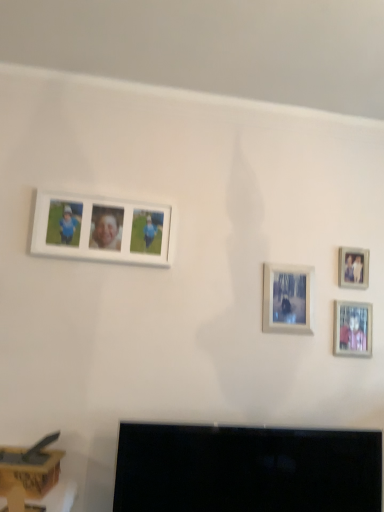
Question: Can you confirm if black glossy tv at lower center is shorter than white matte photo frame at upper left, placed as the 4th picture frame when sorted from right to left?

Choices:
 (A) no
 (B) yes

Answer: (A)

Question: Does black glossy tv at lower center lie behind white matte photo frame at upper left, which ranks as the 1th picture frame in left-to-right order?

Choices:
 (A) no
 (B) yes

Answer: (A)

Question: Does black glossy tv at lower center have a greater width compared to white matte photo frame at upper left, which ranks as the 1th picture frame in left-to-right order?

Choices:
 (A) no
 (B) yes

Answer: (B)

Question: Is black glossy tv at lower center to the left of white matte photo frame at upper left, placed as the 4th picture frame when sorted from right to left, from the viewer's perspective?

Choices:
 (A) no
 (B) yes

Answer: (A)

Question: From the image's perspective, is black glossy tv at lower center under white matte photo frame at upper left, placed as the 4th picture frame when sorted from right to left?

Choices:
 (A) yes
 (B) no

Answer: (A)

Question: Does black glossy tv at lower center have a greater height compared to white matte photo frame at upper left, placed as the 4th picture frame when sorted from right to left?

Choices:
 (A) no
 (B) yes

Answer: (B)

Question: Is white matte photo frame at upper left, placed as the 4th picture frame when sorted from right to left, surrounding wooden photo frame at upper right, the first picture frame when ordered from right to left?

Choices:
 (A) no
 (B) yes

Answer: (A)

Question: Considering the relative sizes of white matte photo frame at upper left, placed as the 4th picture frame when sorted from right to left, and wooden photo frame at upper right, which appears as the 4th picture frame when viewed from the left, in the image provided, is white matte photo frame at upper left, placed as the 4th picture frame when sorted from right to left, thinner than wooden photo frame at upper right, which appears as the 4th picture frame when viewed from the left,?

Choices:
 (A) yes
 (B) no

Answer: (B)

Question: Does white matte photo frame at upper left, which ranks as the 1th picture frame in left-to-right order, have a greater width compared to wooden photo frame at upper right, which appears as the 4th picture frame when viewed from the left?

Choices:
 (A) no
 (B) yes

Answer: (B)

Question: Is white matte photo frame at upper left, placed as the 4th picture frame when sorted from right to left, further to the viewer compared to wooden photo frame at upper right, which appears as the 4th picture frame when viewed from the left?

Choices:
 (A) yes
 (B) no

Answer: (B)

Question: Is white matte photo frame at upper left, which ranks as the 1th picture frame in left-to-right order, positioned with its back to wooden photo frame at upper right, which appears as the 4th picture frame when viewed from the left?

Choices:
 (A) yes
 (B) no

Answer: (B)

Question: From the image's perspective, is white matte photo frame at upper left, placed as the 4th picture frame when sorted from right to left, beneath wooden photo frame at upper right, the first picture frame when ordered from right to left?

Choices:
 (A) yes
 (B) no

Answer: (B)

Question: Is black glossy tv at lower center a part of matte silver photo frame at lower right, which is counted as the second picture frame, starting from the right?

Choices:
 (A) yes
 (B) no

Answer: (B)